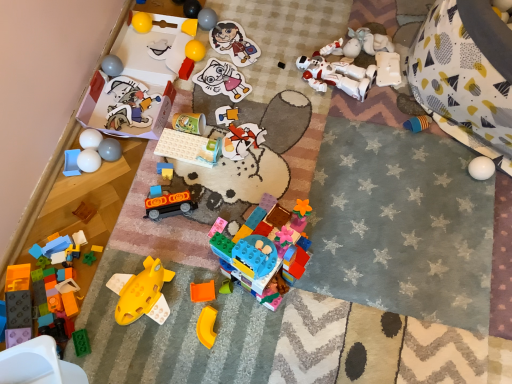
Image resolution: width=512 pixels, height=384 pixels. Identify the location of vacant region to the left of black plastic train at center, which is counted as the tenth toy, starting from the left. (128, 224).